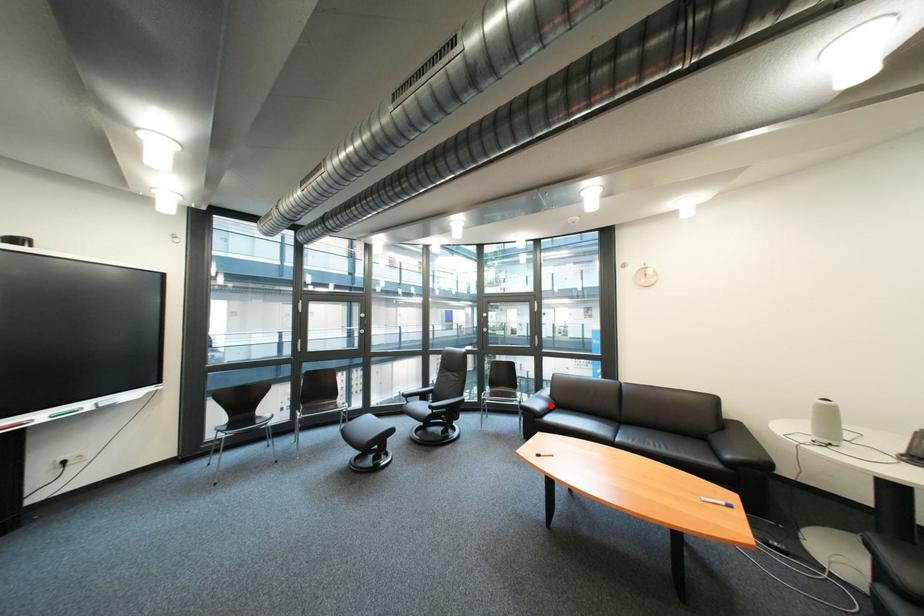
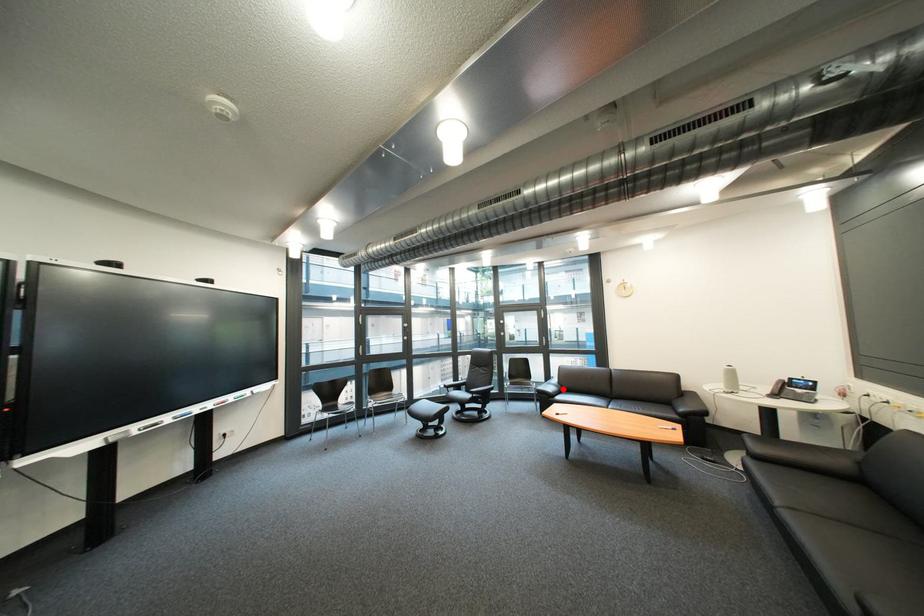
I am providing you with two images of the same scene from different viewpoints. A red point is marked on the first image and another point is marked on the second image. Does the point marked in image1 correspond to the same location as the one in image2?

Yes